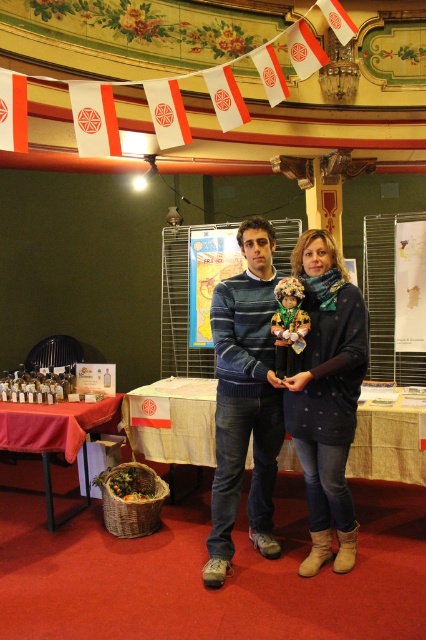
Which is behind, point (143, 444) or point (69, 424)?

Positioned behind is point (143, 444).

Is point (201, 438) positioned after point (42, 444)?

Yes.

Where is `wooden table at center`? wooden table at center is located at coordinates (176, 422).

Is knit sweater at center smaller than wooden table at center?

Correct, knit sweater at center occupies less space than wooden table at center.

Between knit sweater at center and wooden table at center, which one has less height?

wooden table at center is shorter.

Which is behind, point (339, 403) or point (397, 464)?

The point (397, 464) is behind.

Image resolution: width=426 pixels, height=640 pixels. I want to click on knit sweater at center, so click(330, 392).

Can you confirm if knit sweater at center is positioned below red fabric table at lower left?

No.

Find the location of a particular element. The height and width of the screenshot is (640, 426). knit sweater at center is located at coordinates (330, 392).

Describe the element at coordinates (330, 392) in the screenshot. The width and height of the screenshot is (426, 640). I see `knit sweater at center` at that location.

The image size is (426, 640). Find the location of `knit sweater at center`. knit sweater at center is located at coordinates (330, 392).